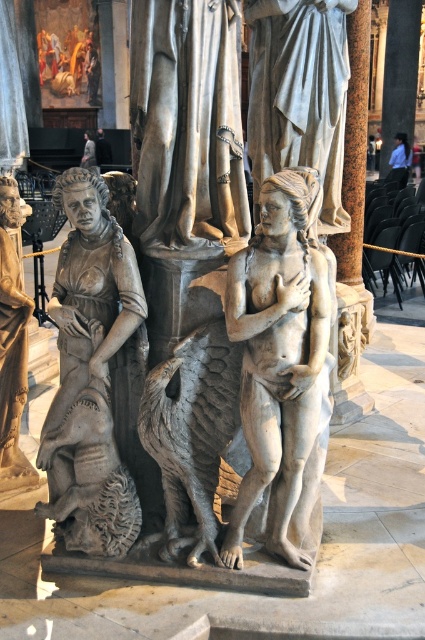
Question: Which point is farther to the camera?

Choices:
 (A) blue fabric shirt at upper right
 (B) matte gray statue at left

Answer: (A)

Question: Among these objects, which one is farthest from the camera?

Choices:
 (A) gray stone statue at center
 (B) smooth stone statue at center
 (C) blue fabric shirt at upper right
 (D) matte gray statue at left

Answer: (C)

Question: Does smooth stone statue at center appear over matte gray statue at left?

Choices:
 (A) yes
 (B) no

Answer: (B)

Question: Which object is closer to the camera taking this photo?

Choices:
 (A) gray stone statue at center
 (B) smooth stone column at center
 (C) matte gray statue at left
 (D) smooth stone statue at center

Answer: (D)

Question: Observing the image, what is the correct spatial positioning of smooth stone statue at center in reference to matte gray statue at left?

Choices:
 (A) left
 (B) right

Answer: (B)

Question: Does smooth stone statue at center appear on the right side of matte gray statue at left?

Choices:
 (A) yes
 (B) no

Answer: (A)